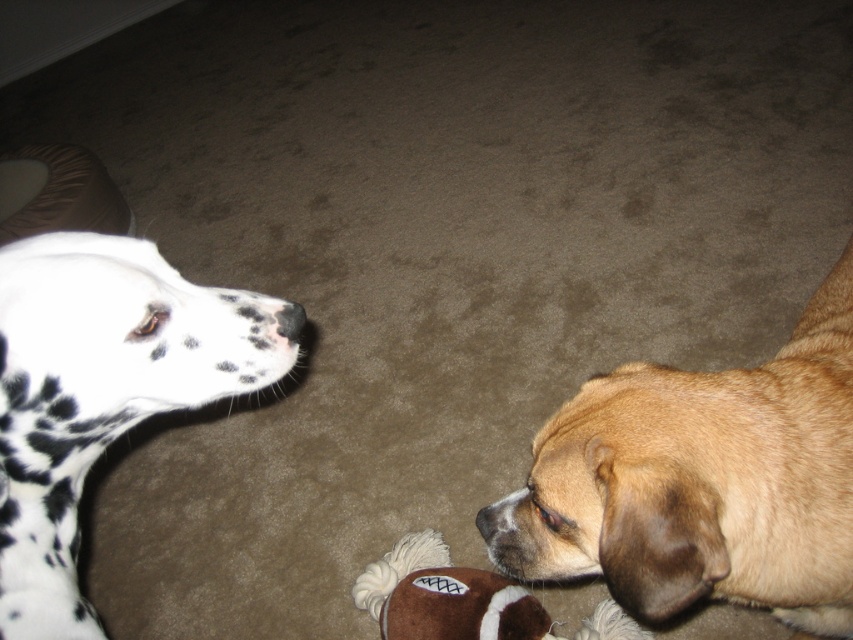
You are a dog trainer observing the scene. You notice the brown furry dog at lower right and the black matte nose at upper left. Which of these two objects is taller?

The brown furry dog at lower right is much taller than the black matte nose at upper left.

You are a photographer setting up a tripod at point [99,392]. You want to capture both the spotted fur dog at left and the other dog with the football. Which direction should you pan the camera to include the other dog?

The spotted fur dog at left is at point [99,392]. To include the other dog with the football, you should pan the camera to the right since the other dog is positioned to the right of the spotted fur dog at left.